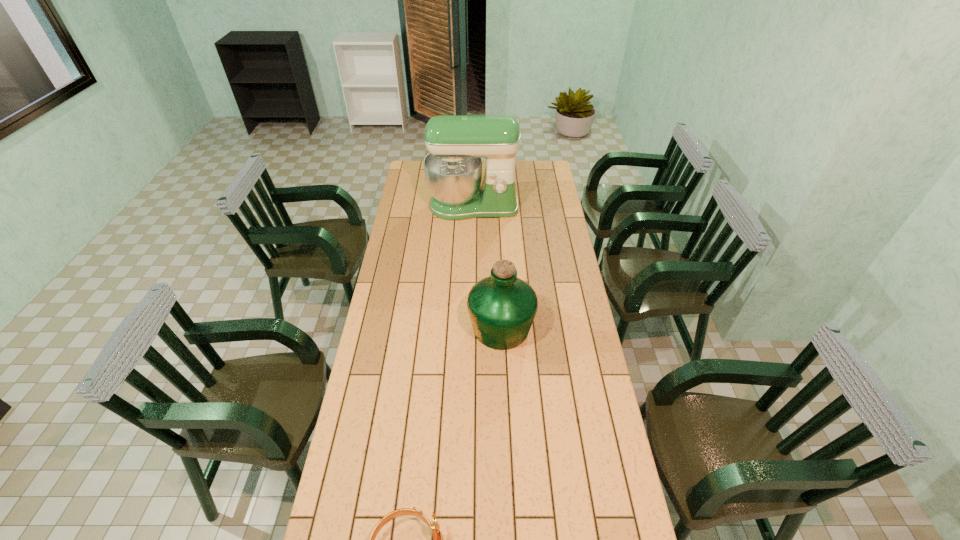
I want to click on the tallest object, so click(457, 143).

Identify the location of the farthest object. This screenshot has height=540, width=960. (457, 143).

Find the location of a particular element. The height and width of the screenshot is (540, 960). the second shortest object is located at coordinates (502, 307).

Find the location of a particular element. liquor is located at coordinates (502, 307).

I want to click on vacant space located 0.190m on the controls of the tallest object, so click(472, 246).

The height and width of the screenshot is (540, 960). I want to click on vacant space located 0.110m on the label side of the second nearest object, so click(x=441, y=328).

Locate an element on the screen. The width and height of the screenshot is (960, 540). vacant space located on the label side of the second nearest object is located at coordinates (391, 328).

This screenshot has width=960, height=540. I want to click on vacant space located on the label side of the second nearest object, so click(x=396, y=328).

Locate an element on the screen. object positioned at the left edge is located at coordinates pyautogui.click(x=457, y=143).

In the image, there is a desktop. At what (x,y) coordinates should I click in order to perform the action: click on free space at the left edge. Please return your answer as a coordinate pair (x, y). Looking at the image, I should click on (407, 186).